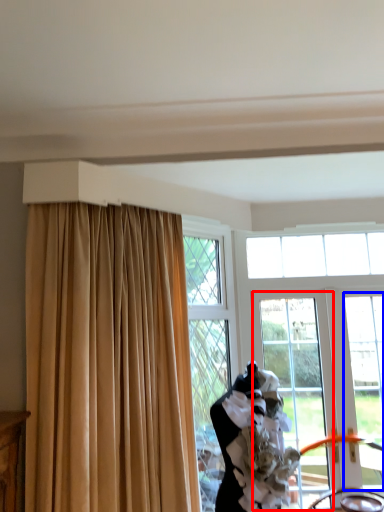
Question: Which point is further to the camera, window screen (highlighted by a red box) or window (highlighted by a blue box)?

Choices:
 (A) window screen
 (B) window

Answer: (A)